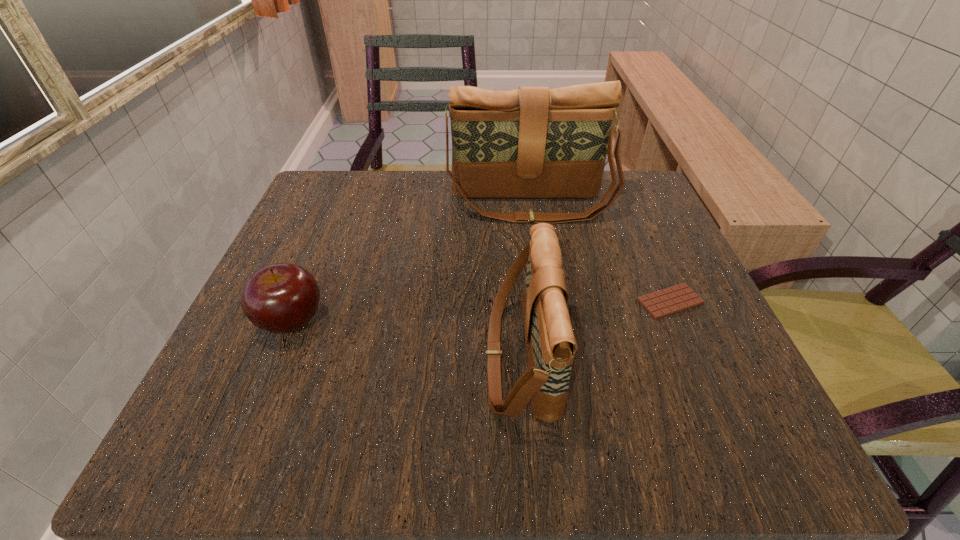
Where is `vacant space located on the front-facing side of the nearer shoulder bag`? This screenshot has width=960, height=540. vacant space located on the front-facing side of the nearer shoulder bag is located at coordinates (319, 358).

Identify the location of free space located on the right of the leftmost object. The height and width of the screenshot is (540, 960). (375, 321).

Where is `vacant space located on the left of the shortest object`? vacant space located on the left of the shortest object is located at coordinates (589, 301).

Locate an element on the screen. object located in the far edge section of the desktop is located at coordinates (532, 142).

Locate an element on the screen. The width and height of the screenshot is (960, 540). object at the near edge is located at coordinates (550, 343).

I want to click on object positioned at the left edge, so (x=280, y=298).

Locate an element on the screen. This screenshot has height=540, width=960. shoulder bag that is at the right edge is located at coordinates (532, 142).

This screenshot has height=540, width=960. In order to click on candy bar present at the right edge in this screenshot , I will do `click(680, 297)`.

Find the location of a particular element. The height and width of the screenshot is (540, 960). object that is at the far right corner is located at coordinates (532, 142).

The width and height of the screenshot is (960, 540). Identify the location of vacant space at the far edge. (416, 170).